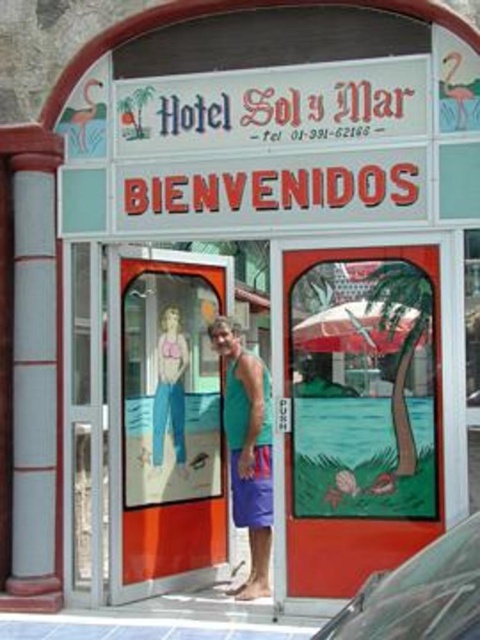
Does transparent plastic car at lower right lie in front of red matte umbrella at center?

Yes, transparent plastic car at lower right is closer to the viewer.

Who is positioned more to the right, transparent plastic car at lower right or red matte umbrella at center?

From the viewer's perspective, red matte umbrella at center appears more on the right side.

What do you see at coordinates (419, 595) in the screenshot? I see `transparent plastic car at lower right` at bounding box center [419, 595].

In order to click on transparent plastic car at lower right in this screenshot , I will do `click(419, 595)`.

This screenshot has height=640, width=480. Describe the element at coordinates (419, 595) in the screenshot. I see `transparent plastic car at lower right` at that location.

Who is more distant from viewer, [354,625] or [267,552]?

The point [267,552] is behind.

The height and width of the screenshot is (640, 480). Find the location of `transparent plastic car at lower right`. transparent plastic car at lower right is located at coordinates (419, 595).

Measure the distance between point (245,490) and camera.

They are 7.03 meters apart.

Is point (255, 376) farther from camera compared to point (159, 378)?

No, (255, 376) is closer to viewer.

The height and width of the screenshot is (640, 480). Find the location of `teal fabric tank top at center`. teal fabric tank top at center is located at coordinates (248, 451).